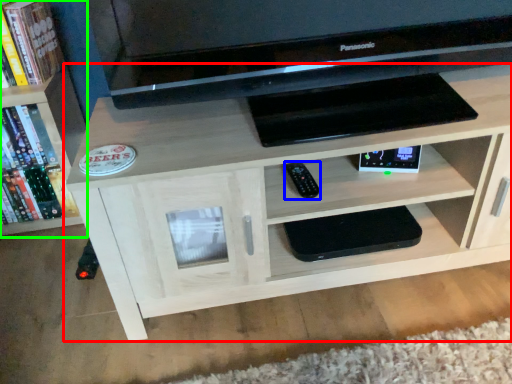
Question: Which is nearer to the shelf (highlighted by a red box)? remote (highlighted by a blue box) or bookcase (highlighted by a green box).

Choices:
 (A) remote
 (B) bookcase

Answer: (A)